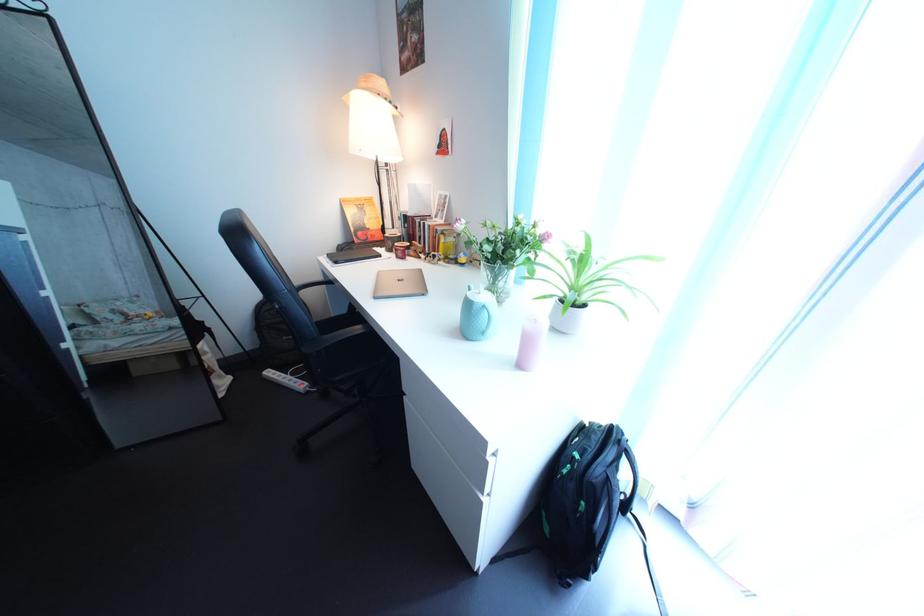
This screenshot has height=616, width=924. What do you see at coordinates (286, 379) in the screenshot?
I see `the power strip switch` at bounding box center [286, 379].